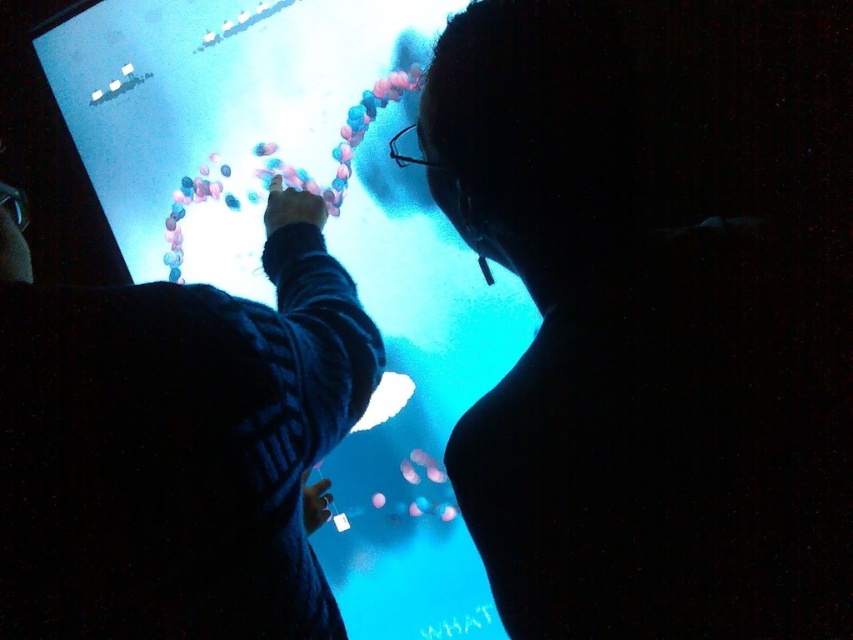
Consider the image. Is silhouette face at upper center shorter than dark blue sweater at upper center?

No, silhouette face at upper center is not shorter than dark blue sweater at upper center.

Which is in front, point (683, 259) or point (0, 516)?

Point (0, 516) is more forward.

You are a GUI agent. You are given a task and a screenshot of the screen. Output one action in this format:
    pyautogui.click(x=<x>, y=<y>)
    Task: Click on the silhouette face at upper center
    
    Given the screenshot: What is the action you would take?
    pyautogui.click(x=637, y=355)